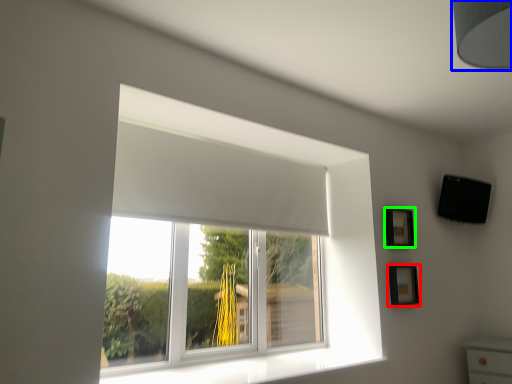
Question: Which object is positioned closest to picture frame (highlighted by a red box)? Select from lamp (highlighted by a blue box) and picture frame (highlighted by a green box).

Choices:
 (A) lamp
 (B) picture frame

Answer: (B)